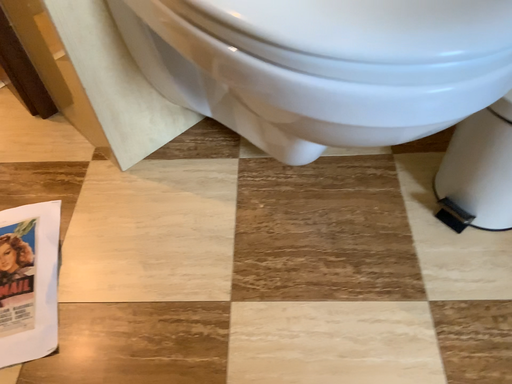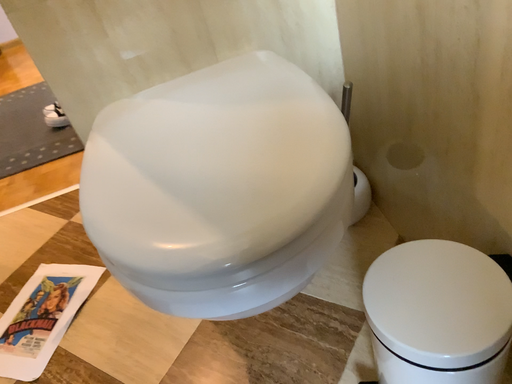
Question: Which way did the camera rotate in the video?

Choices:
 (A) rotated right
 (B) rotated left

Answer: (B)